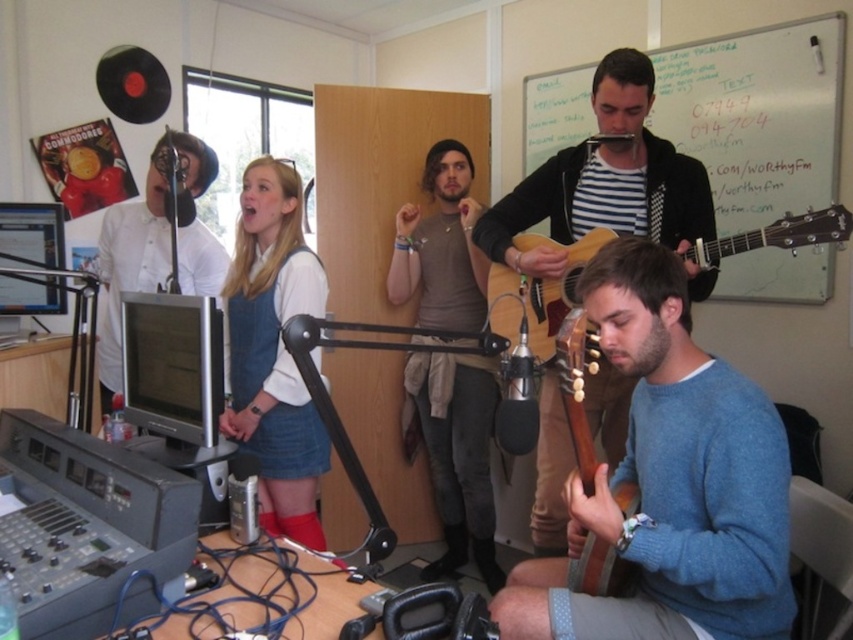
Question: Among these objects, which one is farthest from the camera?

Choices:
 (A) blue sweater at center
 (B) whiteboard at upper center

Answer: (B)

Question: Considering the relative positions of blue sweater at center and brown wooden guitar at lower right in the image provided, where is blue sweater at center located with respect to brown wooden guitar at lower right?

Choices:
 (A) left
 (B) right

Answer: (B)

Question: Does whiteboard at upper center have a smaller size compared to brown wooden guitar at lower right?

Choices:
 (A) no
 (B) yes

Answer: (A)

Question: Does blue sweater at center appear under whiteboard at upper center?

Choices:
 (A) yes
 (B) no

Answer: (A)

Question: Which object is the farthest from the brown wooden guitar at lower right?

Choices:
 (A) whiteboard at upper center
 (B) matte black guitar at center
 (C) light brown wooden guitar at lower right
 (D) blue sweater at center

Answer: (A)

Question: Which of the following is the closest to the observer?

Choices:
 (A) (833, 189)
 (B) (496, 301)
 (C) (489, 369)

Answer: (B)